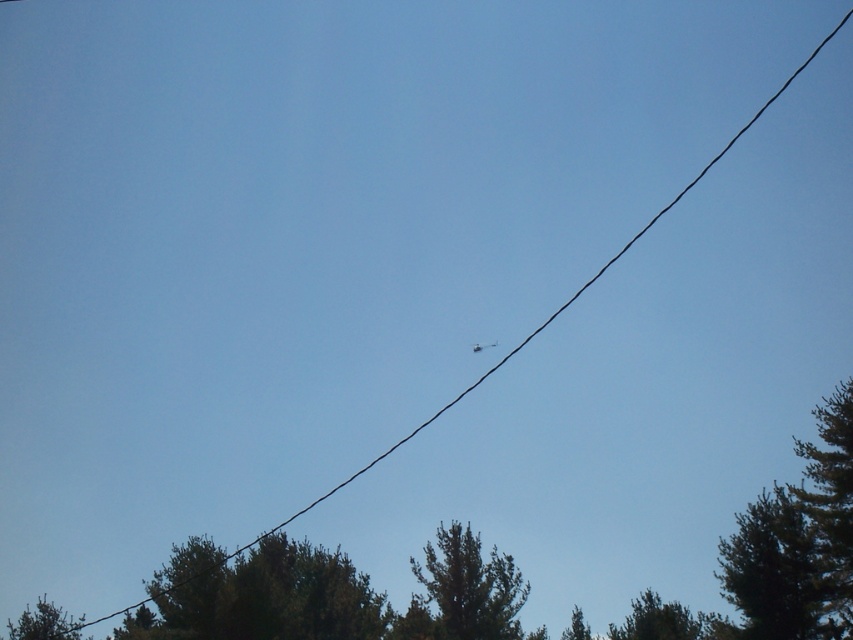
Question: Estimate the real-world distances between objects in this image. Which object is farther from the green leafy tree at upper center?

Choices:
 (A) green matte tree at lower left
 (B) green textured tree at upper right
 (C) green leafy tree at lower left
 (D) metallic silver plane at center

Answer: (D)

Question: Which of the following is the closest to the observer?

Choices:
 (A) (805, 637)
 (B) (430, 576)
 (C) (44, 604)

Answer: (A)

Question: Which object is closer to the camera taking this photo?

Choices:
 (A) green leafy tree at upper right
 (B) green textured tree at upper right

Answer: (A)

Question: Can you confirm if green textured tree at upper right is thinner than green leafy tree at upper right?

Choices:
 (A) yes
 (B) no

Answer: (A)

Question: Is green leafy tree at lower right smaller than metallic silver plane at center?

Choices:
 (A) no
 (B) yes

Answer: (A)

Question: Is green leafy tree at upper center to the right of metallic silver plane at center from the viewer's perspective?

Choices:
 (A) no
 (B) yes

Answer: (A)